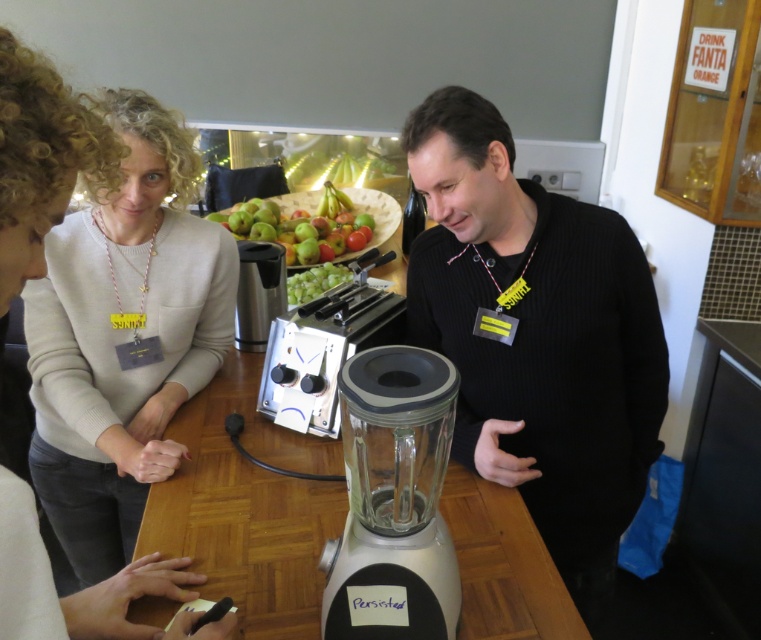
Question: Which point is farther to the camera?

Choices:
 (A) transparent glass blender at center
 (B) light beige sweater at center
 (C) green matte fruit bowl at center

Answer: (C)

Question: Which of the following is the farthest from the observer?

Choices:
 (A) (333, 227)
 (B) (333, 560)
 (C) (484, 509)

Answer: (A)

Question: Is wooden table at center further to the viewer compared to green matte fruit bowl at center?

Choices:
 (A) no
 (B) yes

Answer: (A)

Question: Is light beige sweater at center thinner than green matte fruit bowl at center?

Choices:
 (A) yes
 (B) no

Answer: (A)

Question: Which object is closer to the camera taking this photo?

Choices:
 (A) light beige sweater at center
 (B) wooden table at center
 (C) green matte fruit bowl at center

Answer: (A)

Question: Can you confirm if black knitted sweater at center is positioned above wooden table at center?

Choices:
 (A) no
 (B) yes

Answer: (B)